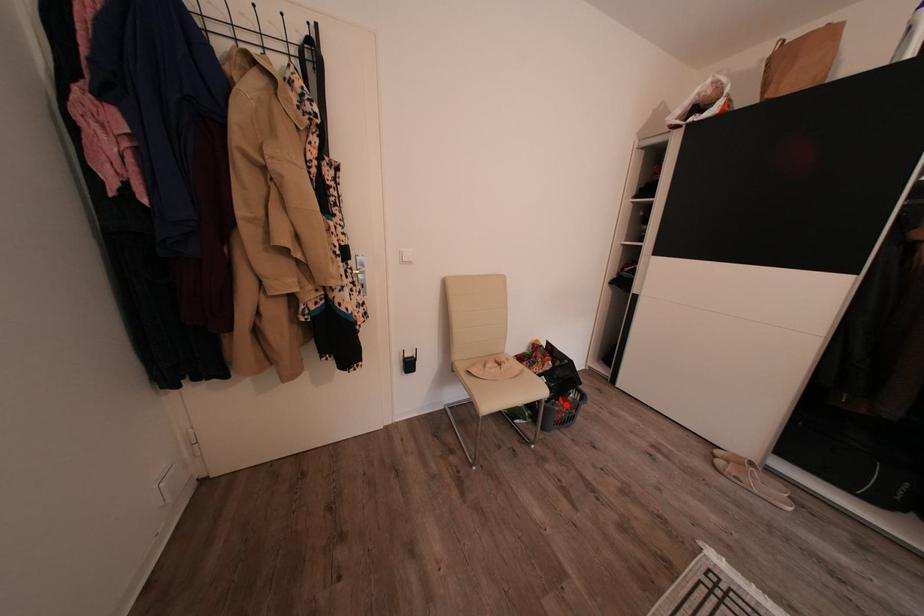
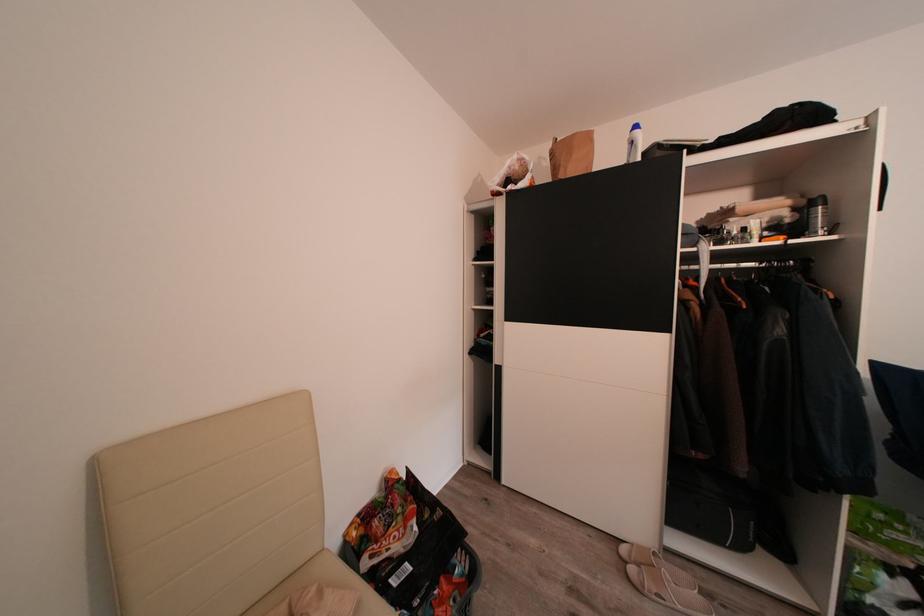
In the second image, find the point that corresponds to the highlighted location in the first image.

(446, 589)